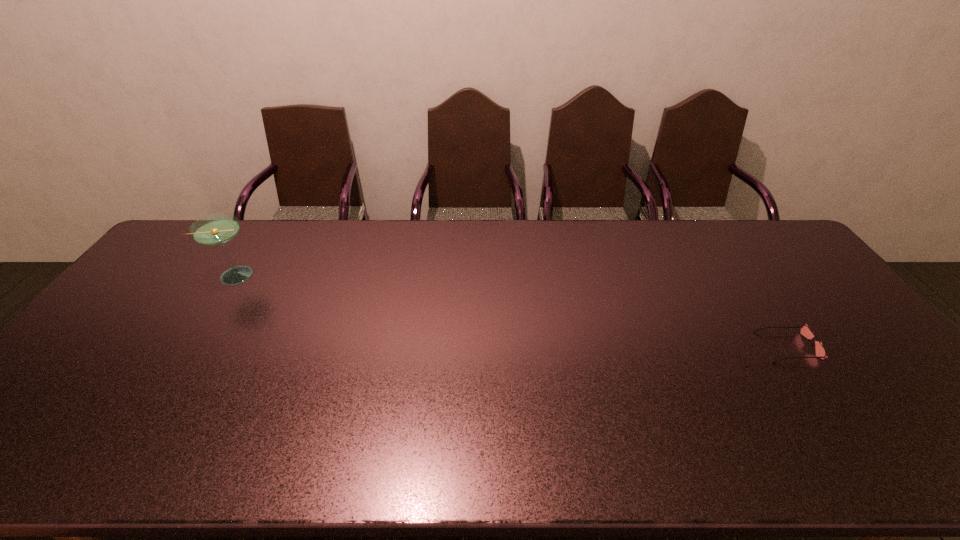
What are the coordinates of `the farther object` in the screenshot? It's located at (217, 229).

At what (x,y) coordinates should I click in order to perform the action: click on martini. Please return your answer as a coordinate pair (x, y). Image resolution: width=960 pixels, height=540 pixels. Looking at the image, I should click on (217, 229).

Identify the location of the right object. (805, 330).

Image resolution: width=960 pixels, height=540 pixels. Find the location of `the nearer object`. the nearer object is located at coordinates (805, 330).

The width and height of the screenshot is (960, 540). In order to click on free space located on the front of the taller object in this screenshot , I will do `click(180, 365)`.

You are a GUI agent. You are given a task and a screenshot of the screen. Output one action in this format:
    pyautogui.click(x=<x>, y=<y>)
    Task: Click on the vacant space located on the bridge of the sunglasses
    The height and width of the screenshot is (540, 960).
    Given the screenshot: What is the action you would take?
    pyautogui.click(x=626, y=347)

What are the coordinates of `free space located 0.170m on the bridge of the sunglasses` in the screenshot? It's located at (700, 347).

Identify the location of free space located 0.120m on the bridge of the sunglasses. This screenshot has height=540, width=960. (718, 347).

At what (x,y) coordinates should I click in order to perform the action: click on vacant space at the far edge of the desktop. Please return your answer as a coordinate pair (x, y). The height and width of the screenshot is (540, 960). Looking at the image, I should click on (400, 242).

Identify the location of free space at the right edge of the desktop. (795, 310).